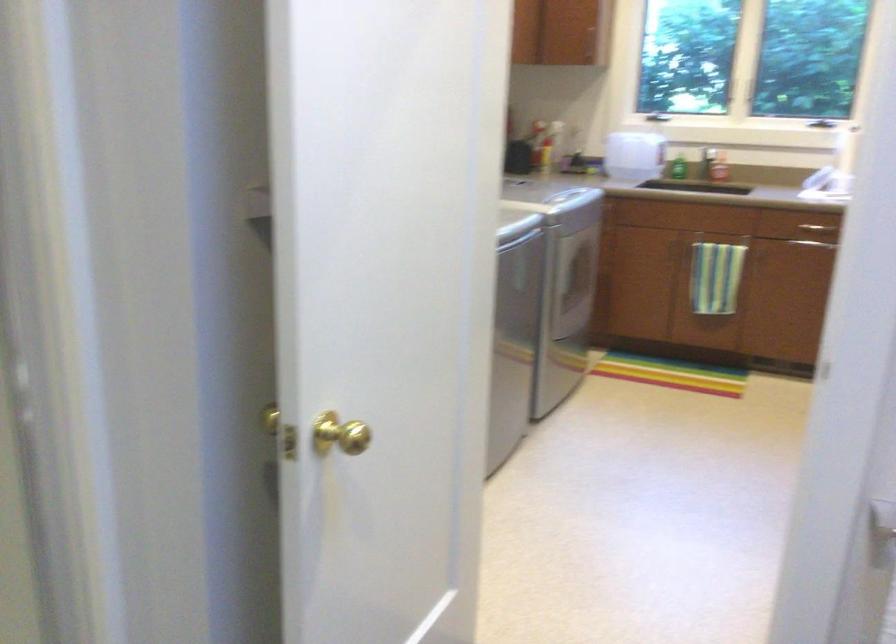
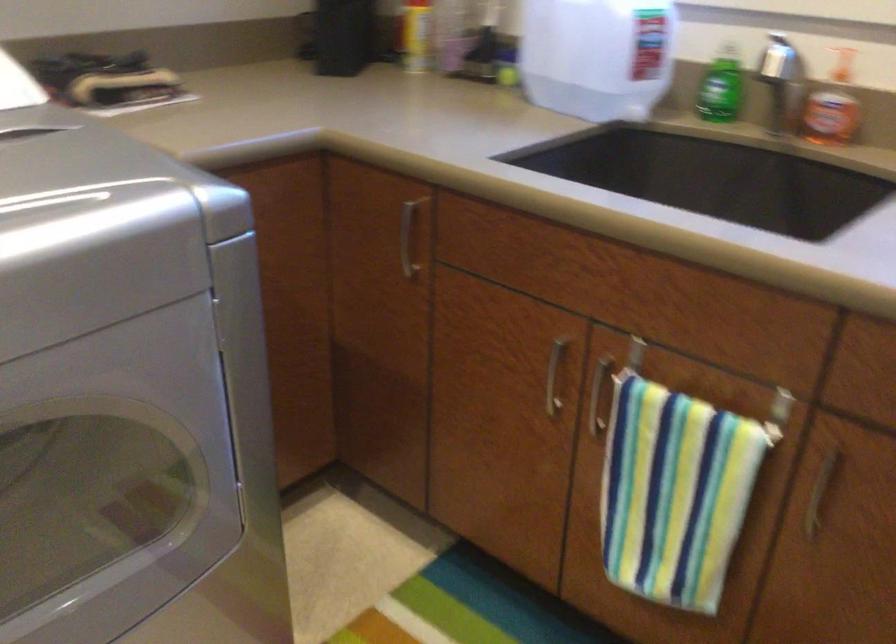
The point at (599, 214) is marked in the first image. Where is the corresponding point in the second image?

(407, 238)